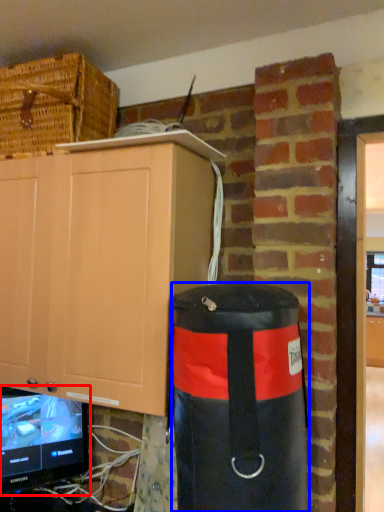
Question: Which point is closer to the camera, television (highlighted by a red box) or punching bag (highlighted by a blue box)?

Choices:
 (A) television
 (B) punching bag

Answer: (B)